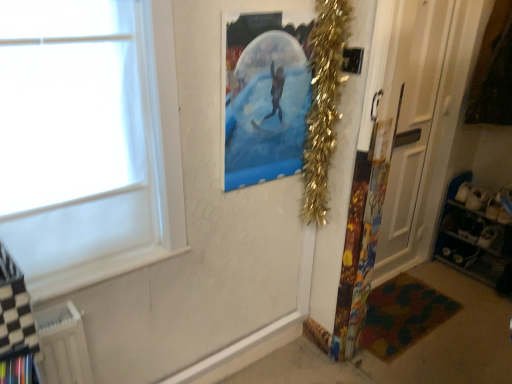
The width and height of the screenshot is (512, 384). I want to click on vacant space that is to the left of metallic blue shelves at lower right, so click(x=436, y=276).